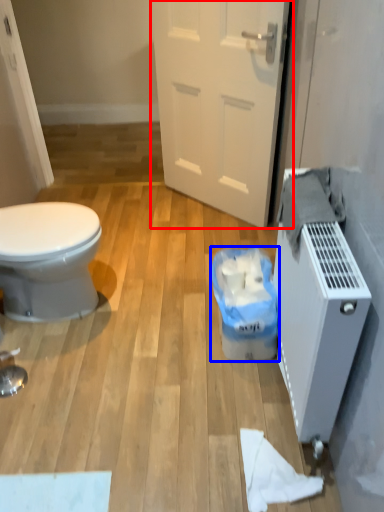
Question: Which object is further to the camera taking this photo, door (highlighted by a red box) or garbage (highlighted by a blue box)?

Choices:
 (A) door
 (B) garbage

Answer: (A)